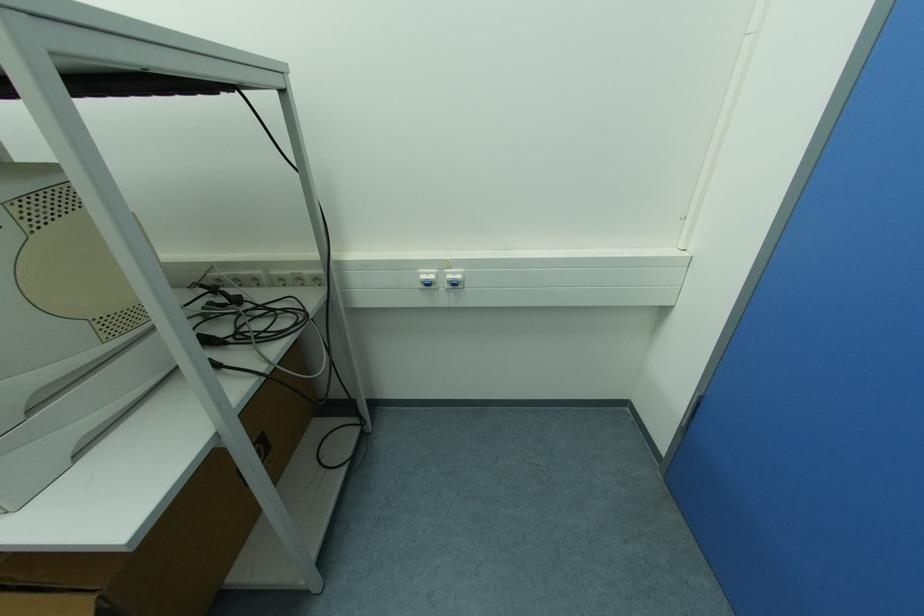
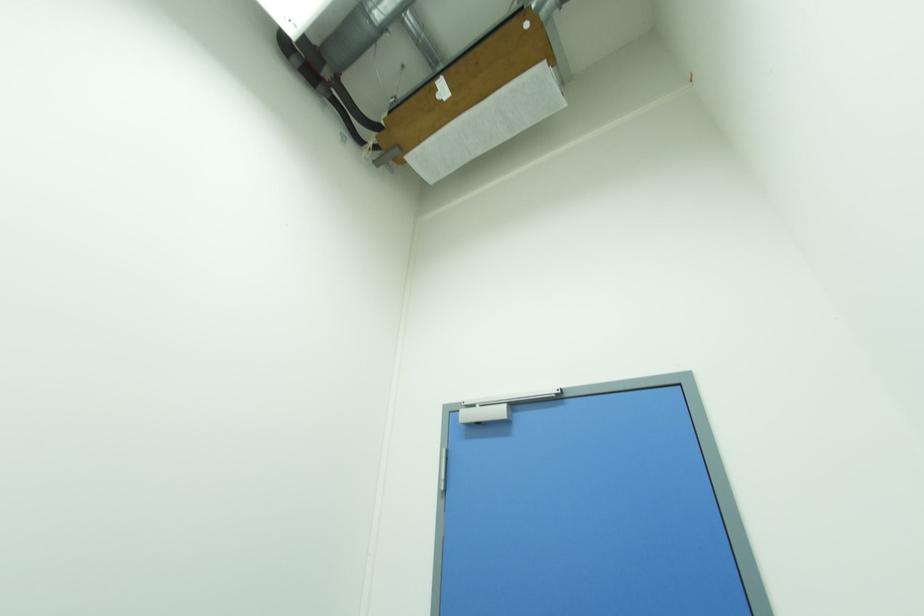
How did the camera likely rotate?

The camera rotated toward right-up.